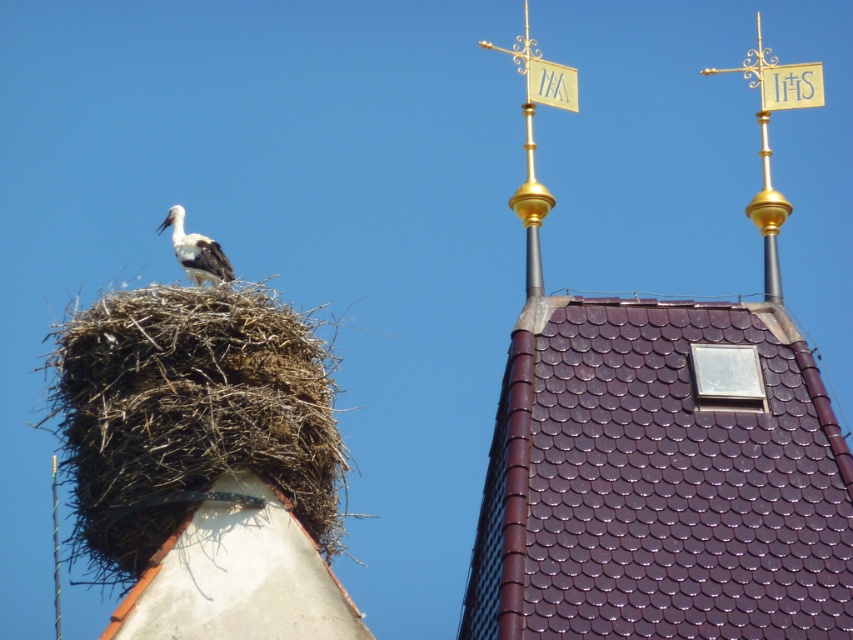
You are a birdwatcher observing the scene from below. You notice the brown straw nest at upper left and the white matte stork at upper left. Which object appears closer to you?

The brown straw nest at upper left appears closer to you than the white matte stork at upper left.

You are an architect analyzing the rooftop layout. You need to place a new solar panel on the rooftop. The solar panel requires a space larger than the brown textured nest at upper left. Can the purple tile roof at upper center accommodate it?

The purple tile roof at upper center is bigger than the brown textured nest at upper left, so yes, the purple tile roof at upper center can accommodate the solar panel since it has a larger space available.

You are a birdwatcher observing the scene from below. You notice the purple tile roof at upper center and the white matte stork at upper left. Which object is positioned higher in the image?

The white matte stork at upper left is positioned higher because the purple tile roof at upper center is below it.